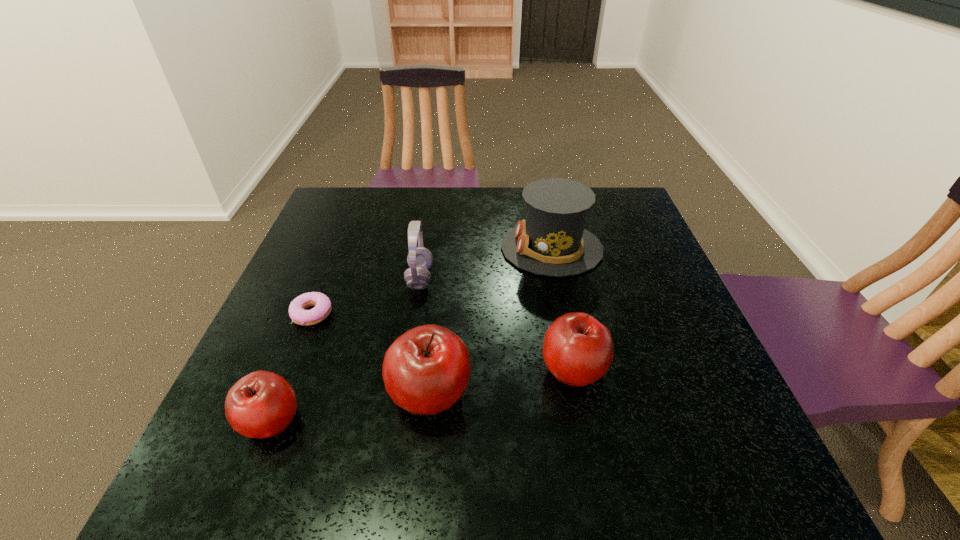
The image size is (960, 540). What are the coordinates of `the second shortest object` in the screenshot? It's located at (262, 404).

Find the location of a particular element. the leftmost apple is located at coordinates (262, 404).

The image size is (960, 540). Identify the location of the second apple from right to left. (425, 371).

Identify the location of the rightmost apple. (578, 350).

Where is `headset`? headset is located at coordinates (420, 259).

Where is `dress hat`? dress hat is located at coordinates (552, 240).

At what (x,y) coordinates should I click in order to perform the action: click on the shortest object. Please return your answer as a coordinate pair (x, y). The width and height of the screenshot is (960, 540). Looking at the image, I should click on (298, 314).

Where is `doughnut`? The height and width of the screenshot is (540, 960). doughnut is located at coordinates (298, 314).

Locate an element on the screen. The height and width of the screenshot is (540, 960). vacant space located on the right of the leftmost apple is located at coordinates (335, 421).

Identify the location of vacant area situated on the right of the second apple from right to left. (548, 394).